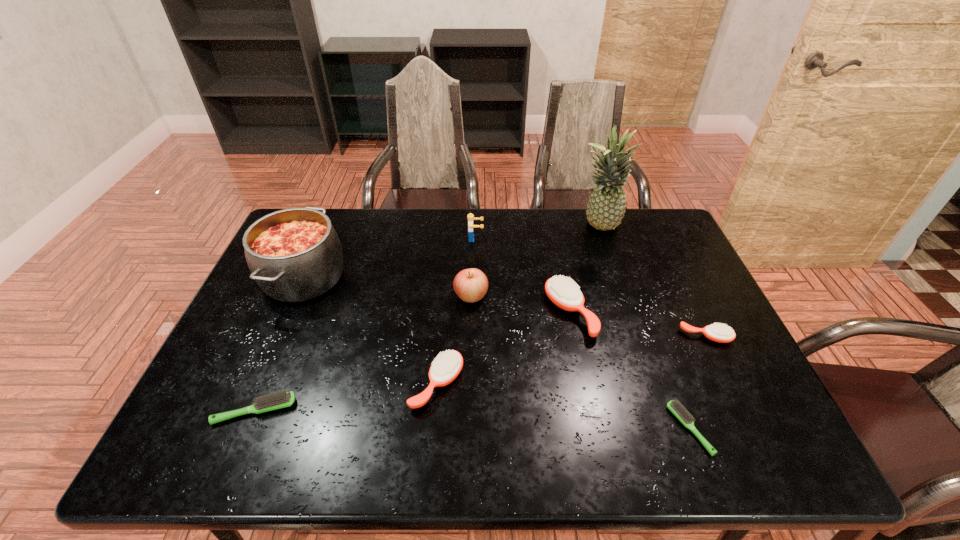
Where is `object located at the far left corner`? Image resolution: width=960 pixels, height=540 pixels. object located at the far left corner is located at coordinates (294, 254).

In order to click on object that is positioned at the near left corner in this screenshot , I will do `click(281, 399)`.

At what (x,y) coordinates should I click in order to perform the action: click on object that is at the near right corner. Please return your answer as a coordinate pair (x, y). This screenshot has height=540, width=960. Looking at the image, I should click on (683, 415).

The height and width of the screenshot is (540, 960). Find the location of `free space at the far edge`. free space at the far edge is located at coordinates (460, 218).

At what (x,y) coordinates should I click in order to perform the action: click on vacant space at the near edge of the desktop. Please return your answer as a coordinate pair (x, y). Image resolution: width=960 pixels, height=540 pixels. Looking at the image, I should click on (430, 430).

What are the coordinates of `free space at the left edge of the desktop` in the screenshot? It's located at (253, 420).

At what (x,y) coordinates should I click in order to perform the action: click on vacant space at the right edge of the desktop. Please return your answer as a coordinate pair (x, y). Looking at the image, I should click on (692, 308).

At what (x,y) coordinates should I click in order to perform the action: click on free space that is in between the casserole and the shortest object. Please return your answer as a coordinate pair (x, y). Image resolution: width=960 pixels, height=540 pixels. Looking at the image, I should click on (496, 353).

The image size is (960, 540). I want to click on free space between the green pineapple and the casserole, so click(451, 252).

This screenshot has height=540, width=960. What are the coordinates of `free spot between the shortest hairbrush and the blue Lego` in the screenshot? It's located at (583, 334).